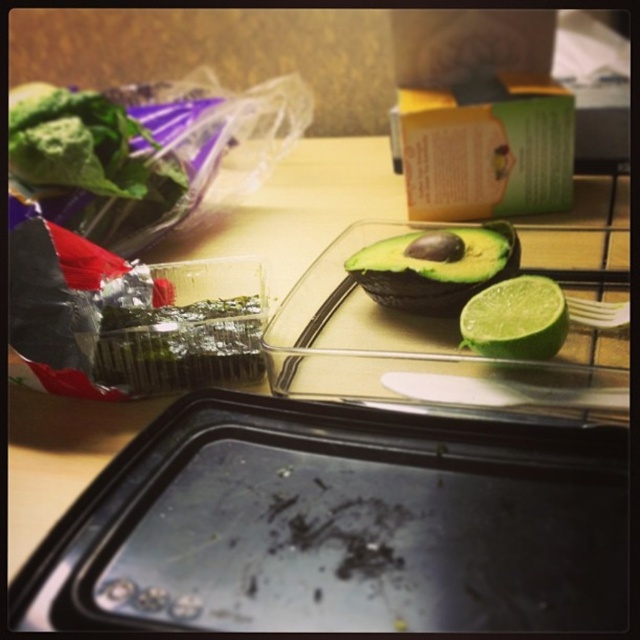
Does transparent glass avocado at center appear over green leafy vegetable at upper left?

Incorrect, transparent glass avocado at center is not positioned above green leafy vegetable at upper left.

Is transparent glass avocado at center further to the viewer compared to green leafy vegetable at upper left?

No, transparent glass avocado at center is in front of green leafy vegetable at upper left.

Where is `transparent glass avocado at center`? The height and width of the screenshot is (640, 640). transparent glass avocado at center is located at coordinates (432, 348).

This screenshot has height=640, width=640. I want to click on transparent glass avocado at center, so click(432, 348).

Between point (301, 330) and point (516, 275), which one is positioned behind?

Positioned behind is point (516, 275).

The image size is (640, 640). What do you see at coordinates (432, 348) in the screenshot?
I see `transparent glass avocado at center` at bounding box center [432, 348].

This screenshot has height=640, width=640. I want to click on transparent glass avocado at center, so click(x=432, y=348).

Does green leafy vegetable at upper left have a greater height compared to green matte lime at center?

Indeed, green leafy vegetable at upper left has a greater height compared to green matte lime at center.

How distant is green leafy vegetable at upper left from green matte lime at center?

38.85 centimeters

The height and width of the screenshot is (640, 640). In order to click on green leafy vegetable at upper left in this screenshot , I will do (x=83, y=145).